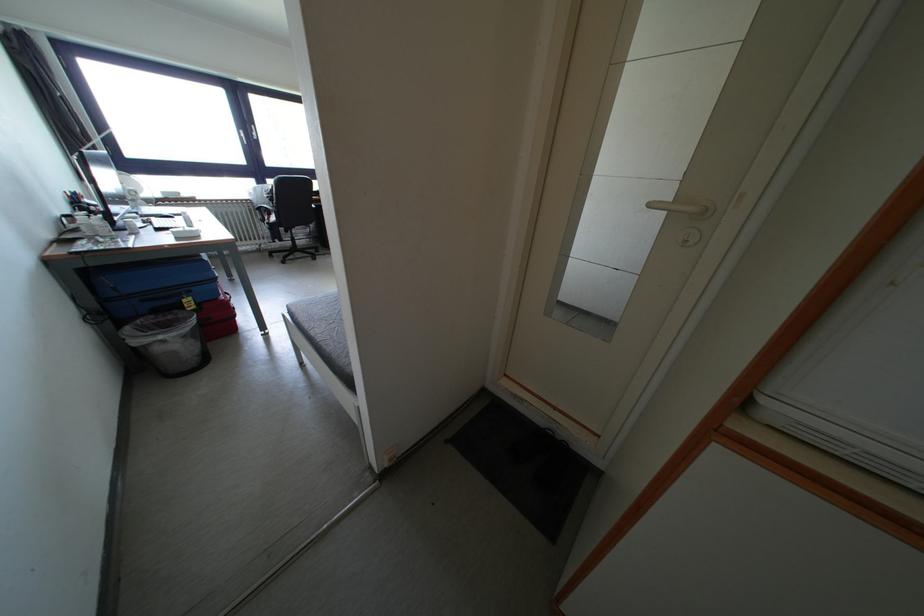
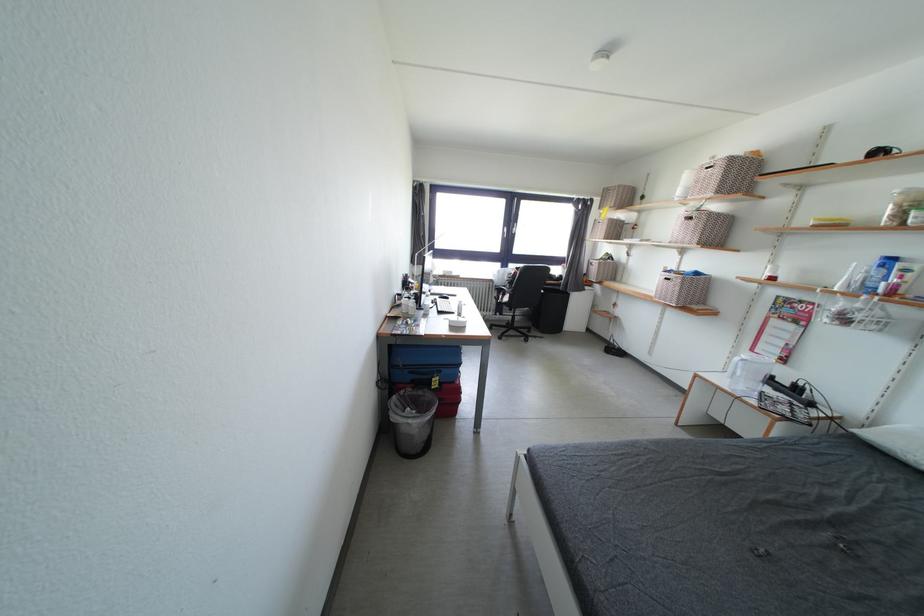
Find the pixel in the second image that matches point 277,204 in the first image.

(517, 286)